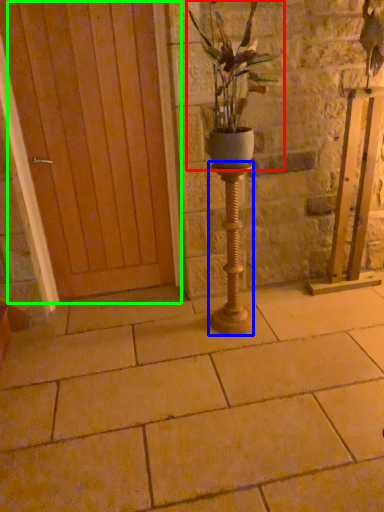
Question: Estimate the real-world distances between objects in this image. Which object is farther from houseplant (highlighted by a red box), candle holder (highlighted by a blue box) or door (highlighted by a green box)?

Choices:
 (A) candle holder
 (B) door

Answer: (B)